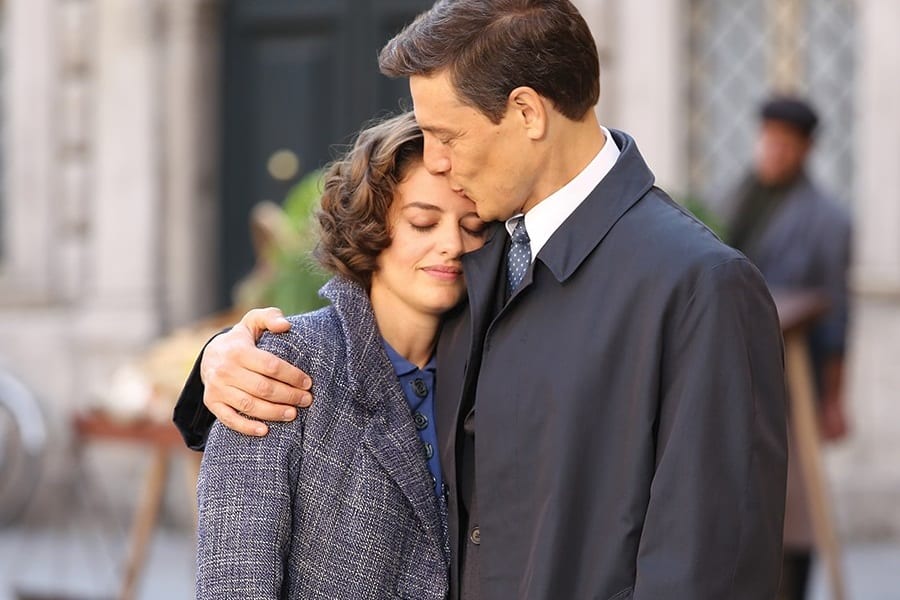
Where is `table`? Image resolution: width=900 pixels, height=600 pixels. table is located at coordinates (130, 431).